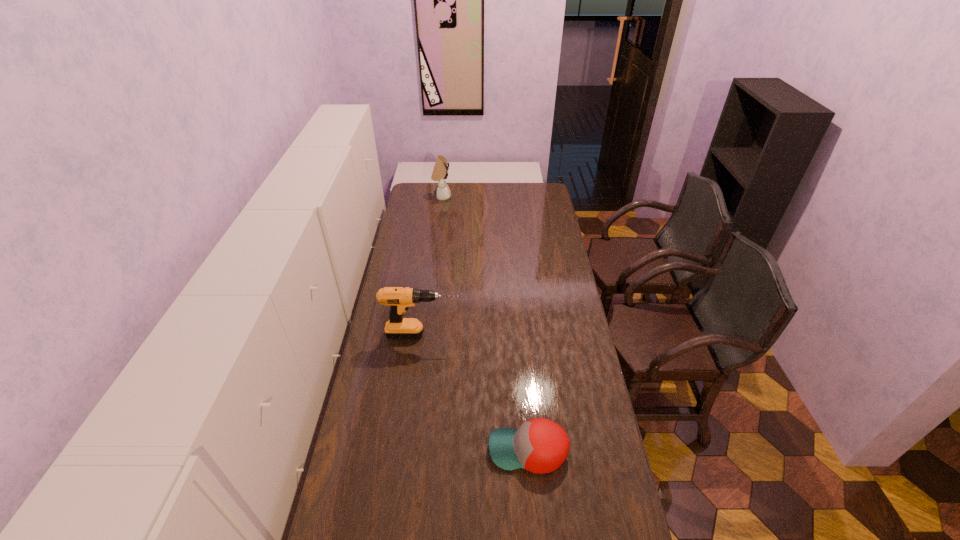
You are a GUI agent. You are given a task and a screenshot of the screen. Output one action in this format:
    pyautogui.click(x=<x>, y=<y>)
    Task: Click on the blank region between the rightmost object and the second nearest object
    Image resolution: width=960 pixels, height=540 pixels.
    Given the screenshot: What is the action you would take?
    pyautogui.click(x=476, y=393)

Where is `free space between the farthest object and the second farthest object`? free space between the farthest object and the second farthest object is located at coordinates (433, 266).

This screenshot has height=540, width=960. I want to click on vacant space that's between the nearest object and the second farthest object, so click(476, 393).

Locate which object ranks in proximity to the rightmost object. Please provide its 2D coordinates. Your answer should be formatted as a tuple, i.e. [(x, y)], where the tuple contains the x and y coordinates of a point satisfying the conditions above.

[(399, 299)]

You are a GUI agent. You are given a task and a screenshot of the screen. Output one action in this format:
    pyautogui.click(x=<x>, y=<y>)
    Task: Click on the object that is the closest to the second farthest object
    This screenshot has height=540, width=960.
    Given the screenshot: What is the action you would take?
    pyautogui.click(x=540, y=445)